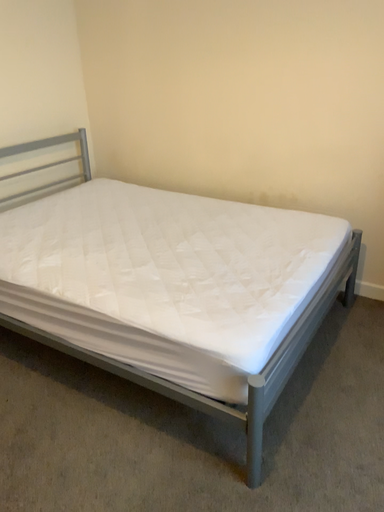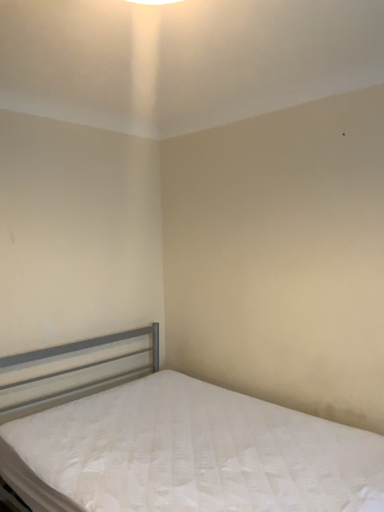
Question: How did the camera likely rotate when shooting the video?

Choices:
 (A) rotated upward
 (B) rotated downward

Answer: (A)